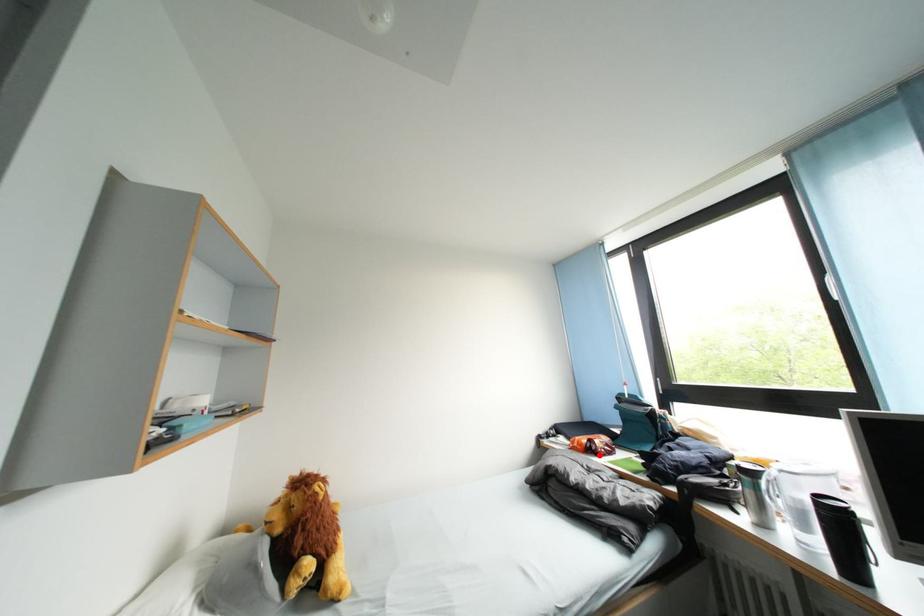
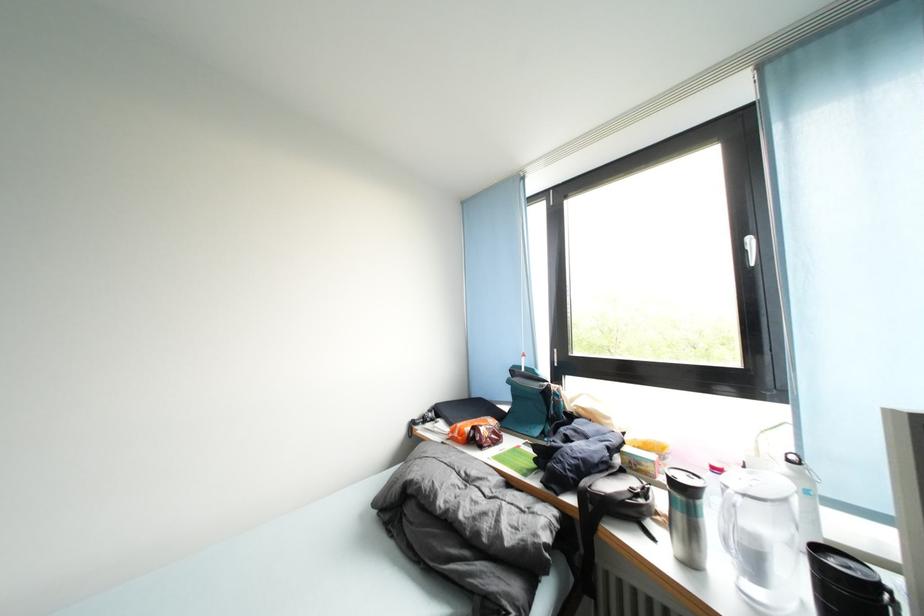
Find the pixel in the second image that matches the highlighted location in the first image.

(482, 446)